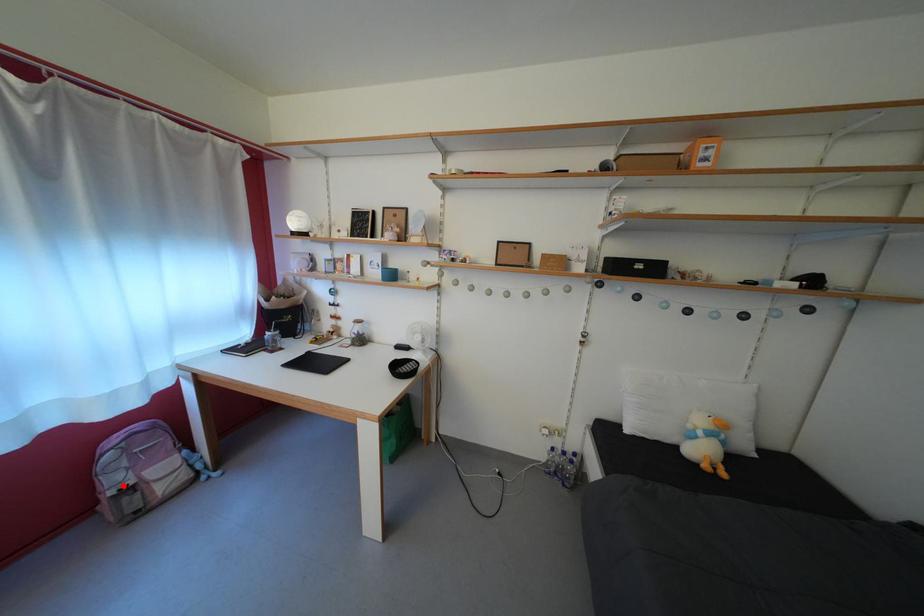
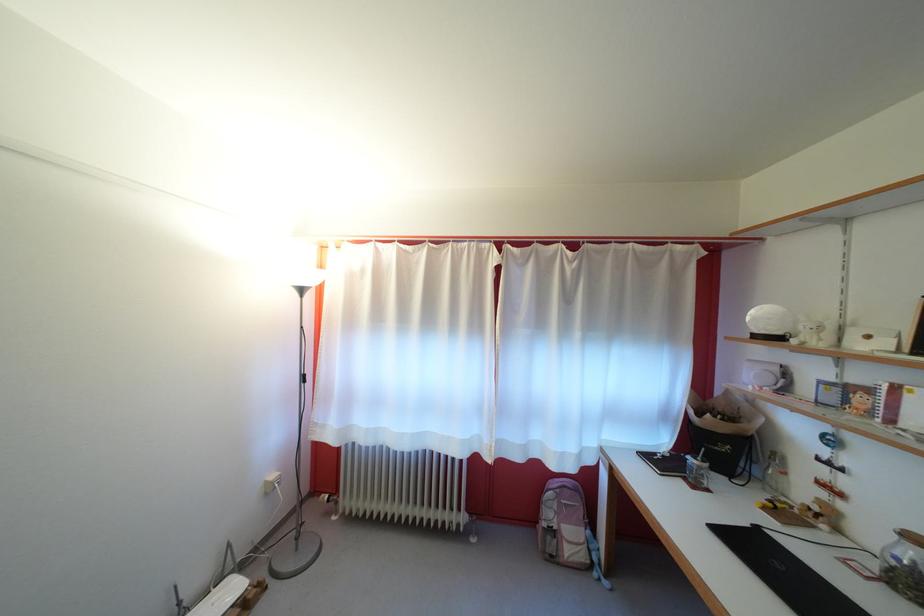
Find the pixel in the second image that matches the highlighted location in the first image.

(556, 521)